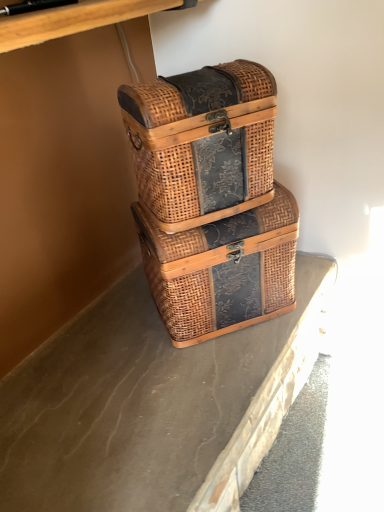
Question: Is woven brown picnic basket at center, acting as the 1th picnic basket starting from the bottom, surrounding brown textured concrete at center?

Choices:
 (A) no
 (B) yes

Answer: (A)

Question: Is woven brown picnic basket at center, acting as the 1th picnic basket starting from the bottom, thinner than brown textured concrete at center?

Choices:
 (A) yes
 (B) no

Answer: (A)

Question: Can you confirm if woven brown picnic basket at center, which is the second picnic basket in top-to-bottom order, is positioned to the right of brown textured concrete at center?

Choices:
 (A) no
 (B) yes

Answer: (B)

Question: Does woven brown picnic basket at center, acting as the 1th picnic basket starting from the bottom, come in front of brown textured concrete at center?

Choices:
 (A) yes
 (B) no

Answer: (B)

Question: From the image's perspective, is woven brown picnic basket at center, acting as the 1th picnic basket starting from the bottom, below brown textured concrete at center?

Choices:
 (A) no
 (B) yes

Answer: (A)

Question: Is woven brown picnic basket at center, which is the second picnic basket in top-to-bottom order, not within brown textured concrete at center?

Choices:
 (A) yes
 (B) no

Answer: (A)

Question: Does brown textured concrete at center come behind woven brown picnic basket at center, acting as the 1th picnic basket starting from the bottom?

Choices:
 (A) yes
 (B) no

Answer: (B)

Question: Is brown textured concrete at center positioned far away from woven brown picnic basket at center, which is the second picnic basket in top-to-bottom order?

Choices:
 (A) yes
 (B) no

Answer: (B)

Question: Is brown textured concrete at center at the right side of woven brown picnic basket at center, which is the second picnic basket in top-to-bottom order?

Choices:
 (A) no
 (B) yes

Answer: (A)

Question: Considering the relative sizes of brown textured concrete at center and woven brown picnic basket at center, acting as the 1th picnic basket starting from the bottom, in the image provided, is brown textured concrete at center thinner than woven brown picnic basket at center, acting as the 1th picnic basket starting from the bottom,?

Choices:
 (A) no
 (B) yes

Answer: (A)

Question: From the image's perspective, is brown textured concrete at center located beneath woven brown picnic basket at center, acting as the 1th picnic basket starting from the bottom?

Choices:
 (A) no
 (B) yes

Answer: (B)

Question: Could you tell me if brown textured concrete at center is facing woven brown picnic basket at center, which is the second picnic basket in top-to-bottom order?

Choices:
 (A) no
 (B) yes

Answer: (A)

Question: Is woven wood picnic basket at center, which is the second picnic basket in bottom-to-top order, touching brown textured concrete at center?

Choices:
 (A) no
 (B) yes

Answer: (A)